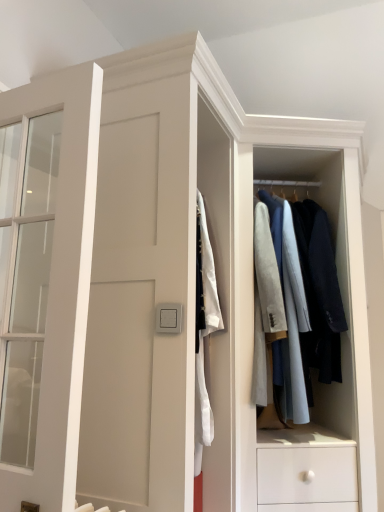
You are a GUI agent. You are given a task and a screenshot of the screen. Output one action in this format:
    pyautogui.click(x=<x>, y=<y>)
    Task: Click on the matte white door at left
    
    Given the screenshot: What is the action you would take?
    click(62, 285)

At what (x,y) coordinates should I click in order to perform the action: click on light gray fabric coat rack at center. Please return your answer as a coordinate pair (x, y). Image resolution: width=384 pixels, height=512 pixels. Looking at the image, I should click on (243, 328).

At what (x,y) coordinates should I click in order to perform the action: click on matte white door at left. Please return your answer as a coordinate pair (x, y). Image resolution: width=384 pixels, height=512 pixels. Looking at the image, I should click on (62, 285).

Identify the location of door below the light gray fabric coat rack at center (from a real-world perspective). (62, 285).

Is light gray fabric coat rack at center bigger or smaller than matte white door at left?

light gray fabric coat rack at center is bigger than matte white door at left.

How different are the orientations of light gray fabric coat rack at center and matte white door at left in degrees?

The angular difference between light gray fabric coat rack at center and matte white door at left is 30.8 degrees.

Which is behind, point (357, 217) or point (70, 383)?

The point (357, 217) is more distant.

Looking at this image, are matte white door at left and light gray fabric coat rack at center making contact?

matte white door at left is not next to light gray fabric coat rack at center, and they're not touching.

Can you confirm if matte white door at left is taller than light gray fabric coat rack at center?

Incorrect, the height of matte white door at left is not larger of that of light gray fabric coat rack at center.

From the picture: Do you think matte white door at left is within light gray fabric coat rack at center, or outside of it?

matte white door at left is located beyond the bounds of light gray fabric coat rack at center.

Can you confirm if matte white door at left is thinner than light gray fabric coat rack at center?

Indeed, matte white door at left has a lesser width compared to light gray fabric coat rack at center.

From the image's perspective, does satin silver switch at center appear lower than matte white door at left?

Yes.

Which is farther from the camera, (178, 330) or (76, 478)?

The point (76, 478) is more distant.

Is satin silver switch at center facing away from matte white door at left?

No, satin silver switch at center is not facing the opposite direction of matte white door at left.

How far apart are satin silver switch at center and light gray fabric coat rack at center?

The distance of satin silver switch at center from light gray fabric coat rack at center is 25.23 inches.

Between satin silver switch at center and light gray fabric coat rack at center, which one appears on the left side from the viewer's perspective?

From the viewer's perspective, satin silver switch at center appears more on the left side.

From the image's perspective, would you say satin silver switch at center is positioned over light gray fabric coat rack at center?

No, from the image's perspective, satin silver switch at center is not over light gray fabric coat rack at center.

From a real-world perspective, who is located higher, satin silver switch at center or light gray fabric coat rack at center?

light gray fabric coat rack at center is physically above.

Considering the sizes of objects light gray fabric coat rack at center and satin silver switch at center in the image provided, who is wider, light gray fabric coat rack at center or satin silver switch at center?

With larger width is light gray fabric coat rack at center.

Can you see light gray fabric coat rack at center touching satin silver switch at center?

No, light gray fabric coat rack at center is not with satin silver switch at center.

Would you say satin silver switch at center is part of light gray fabric coat rack at center's contents?

That's incorrect, satin silver switch at center is not inside light gray fabric coat rack at center.

Is light gray fabric coat rack at center positioned before satin silver switch at center?

No.

Locate an element on the screen. This screenshot has height=512, width=384. light switch below the matte white door at left (from a real-world perspective) is located at coordinates (169, 318).

From their relative heights in the image, would you say matte white door at left is taller or shorter than satin silver switch at center?

Clearly, matte white door at left is taller compared to satin silver switch at center.

Is matte white door at left positioned with its back to satin silver switch at center?

Yes.

Which point is more distant from viewer, (68, 288) or (156, 307)?

The point (156, 307) is more distant.

Where is `dresser that appears below the matte white door at left (from the image's perspective)`? The height and width of the screenshot is (512, 384). dresser that appears below the matte white door at left (from the image's perspective) is located at coordinates (243, 328).

You are a GUI agent. You are given a task and a screenshot of the screen. Output one action in this format:
    pyautogui.click(x=<x>, y=<y>)
    Task: Click on the dresser to the right of matte white door at left
    
    Given the screenshot: What is the action you would take?
    (243, 328)

Based on their spatial positions, is light gray fabric coat rack at center or matte white door at left closer to satin silver switch at center?

matte white door at left is positioned closer to the anchor satin silver switch at center.

Estimate the real-world distances between objects in this image. Which object is further from matte white door at left, light gray fabric coat rack at center or satin silver switch at center?

light gray fabric coat rack at center lies further to matte white door at left than the other object.

From the image, which object appears to be farther from light gray fabric coat rack at center, satin silver switch at center or matte white door at left?

Based on the image, matte white door at left appears to be further to light gray fabric coat rack at center.

From the image, which object appears to be farther from satin silver switch at center, matte white door at left or light gray fabric coat rack at center?

light gray fabric coat rack at center.

Which object lies nearer to the anchor point matte white door at left, satin silver switch at center or light gray fabric coat rack at center?

satin silver switch at center is positioned closer to the anchor matte white door at left.

From the picture: Looking at the image, which one is located further to light gray fabric coat rack at center, matte white door at left or satin silver switch at center?

Among the two, matte white door at left is located further to light gray fabric coat rack at center.

At what (x,y) coordinates should I click in order to perform the action: click on light switch located between matte white door at left and light gray fabric coat rack at center in the left-right direction. Please return your answer as a coordinate pair (x, y). This screenshot has height=512, width=384. Looking at the image, I should click on (169, 318).